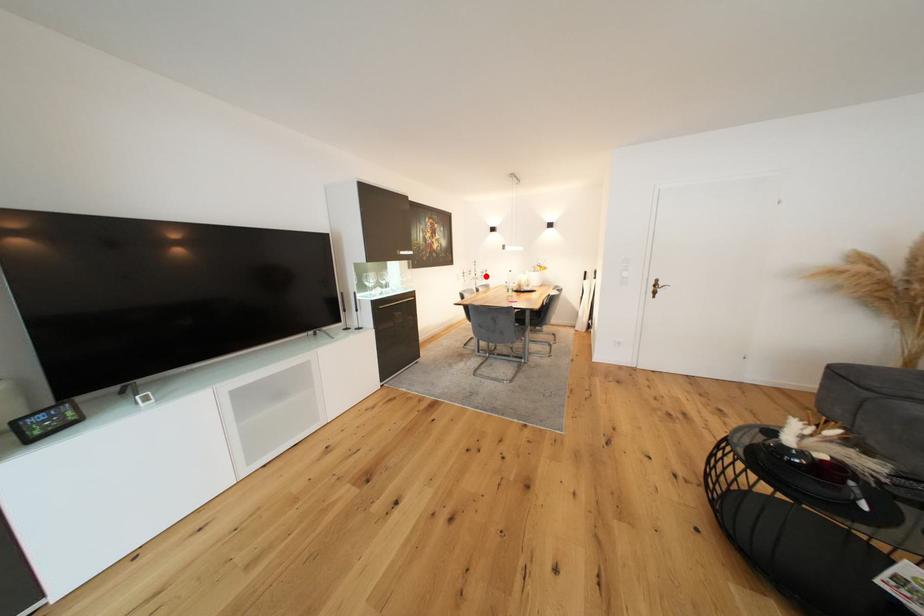
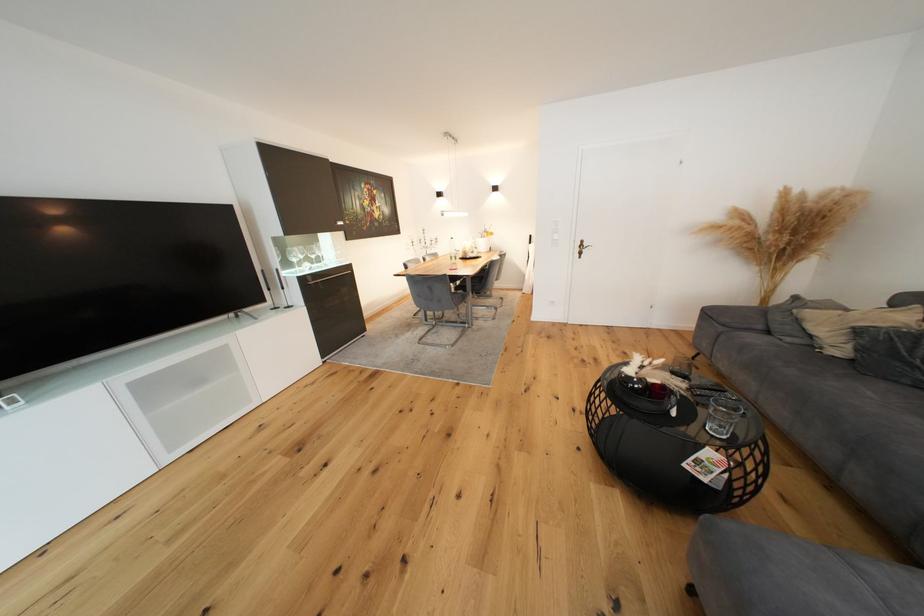
Find the pixel in the second image that matches the highlighted location in the first image.

(435, 245)